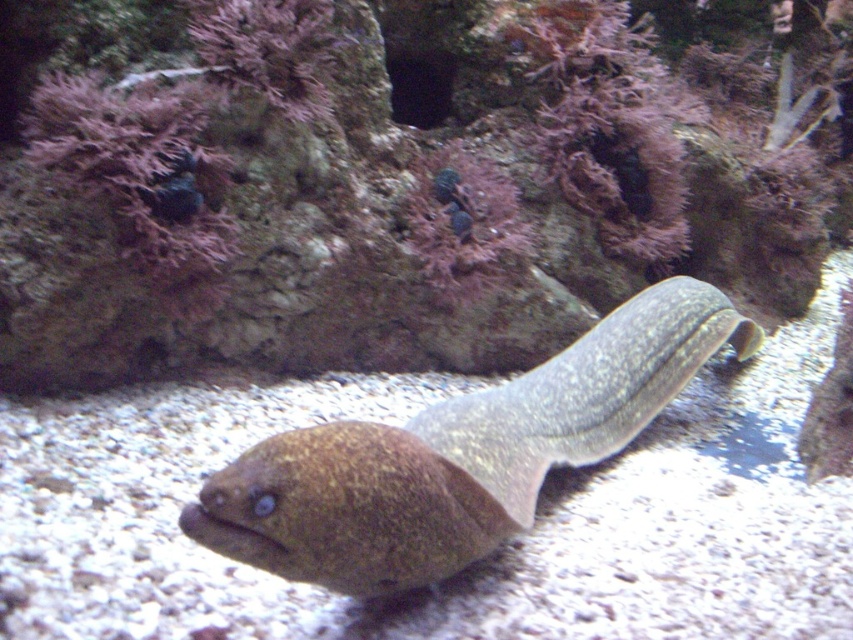
You are an underwater photographer aiming to capture the brown speckled eel at center and the purple coral at upper center in a single frame. Based on their positions, which object is closer to the camera lens?

The brown speckled eel at center is closer to the camera lens because it is positioned below the purple coral at upper center, indicating it is in the foreground.

You are a diver in a tank with two moray eels. You see two points marked in the image. The first point is at coordinate point (x=646, y=192) and the second is at point (x=494, y=198). Which point is closer to you?

Point (x=646, y=192) is further to the camera than point (x=494, y=198), so the point closer to you is point (x=494, y=198).

You are an underwater photographer aiming to capture a clear shot of the purple coral at upper center. However, the brown speckled eel at center is blocking your view. Based on their sizes, can you determine if moving the camera slightly upward might help you see the coral without the eel obstructing it?

The brown speckled eel at center is taller than the purple coral at upper center. Moving the camera upward might allow you to see the purple coral at upper center above the eel since the eel is shorter than the coral.